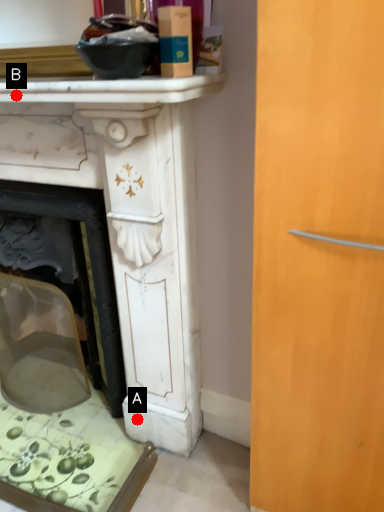
Question: Two points are circled on the image, labeled by A and B beside each circle. Which point is closer to the camera?

Choices:
 (A) A is closer
 (B) B is closer

Answer: (B)